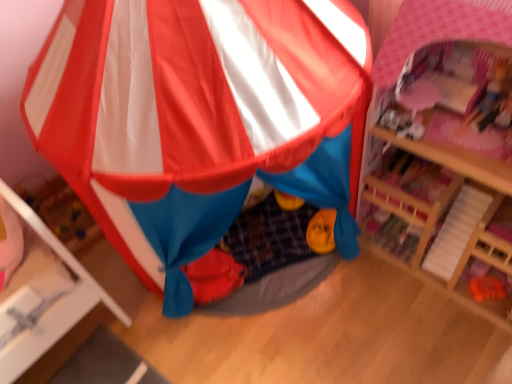
Question: From their relative heights in the image, would you say matte plastic tent at center is taller or shorter than pink wood dollhouse at upper right?

Choices:
 (A) short
 (B) tall

Answer: (B)

Question: Would you say matte plastic tent at center is to the left or to the right of pink wood dollhouse at upper right in the picture?

Choices:
 (A) left
 (B) right

Answer: (A)

Question: Does point [195, 289] appear closer or farther from the camera than point [391, 254]?

Choices:
 (A) farther
 (B) closer

Answer: (B)

Question: Is point (482, 236) positioned closer to the camera than point (90, 165)?

Choices:
 (A) closer
 (B) farther

Answer: (B)

Question: Is pink wood dollhouse at upper right in front of or behind matte plastic tent at center in the image?

Choices:
 (A) front
 (B) behind

Answer: (B)

Question: Looking at their shapes, would you say pink wood dollhouse at upper right is wider or thinner than matte plastic tent at center?

Choices:
 (A) thin
 (B) wide

Answer: (A)

Question: Do you think pink wood dollhouse at upper right is within matte plastic tent at center, or outside of it?

Choices:
 (A) inside
 (B) outside

Answer: (B)